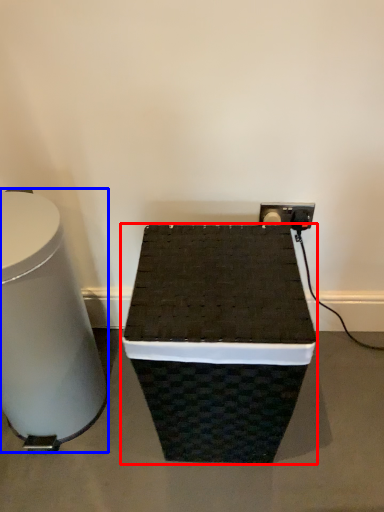
Question: Which point is further to the camera, furniture (highlighted by a red box) or table (highlighted by a blue box)?

Choices:
 (A) furniture
 (B) table

Answer: (A)